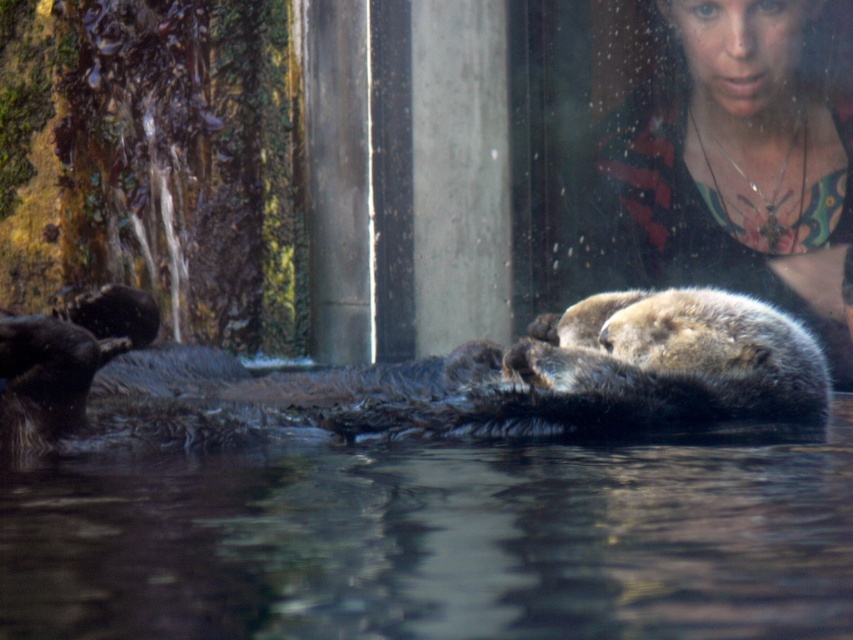
You are a zookeeper observing the sea otters in their enclosure. You notice the dark brown fur otter at center and the smooth black shirt at upper right. Which object is wider?

The dark brown fur otter at center is wider than the smooth black shirt at upper right.

You are a zookeeper planning to place a new feeding station in the enclosure. The feeding station requires a clear space at the center of the enclosure. Is the transparent water at center located at the center point of the enclosure?

The transparent water at center is located at point (439, 541), which is not exactly the center point of the enclosure. Therefore, the feeding station cannot be placed there as it requires the center point.